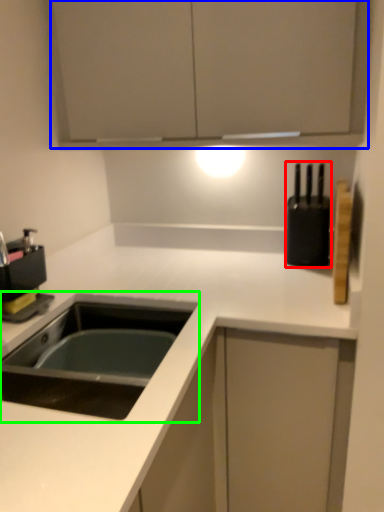
Question: Based on their relative distances, which object is farther from appliance (highlighted by a red box)? Choose from cabinetry (highlighted by a blue box) and sink (highlighted by a green box).

Choices:
 (A) cabinetry
 (B) sink

Answer: (B)